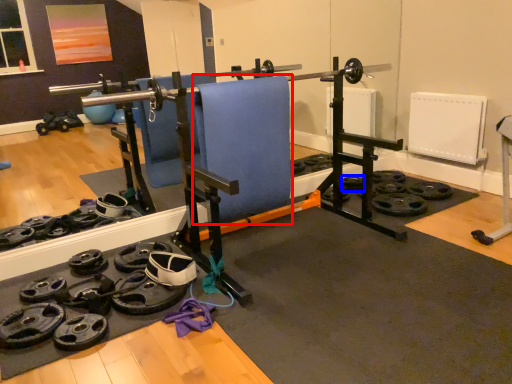
Question: Which object appears farthest to the camera in this image, swivel chair (highlighted by a red box) or wheel (highlighted by a blue box)?

Choices:
 (A) swivel chair
 (B) wheel

Answer: (B)